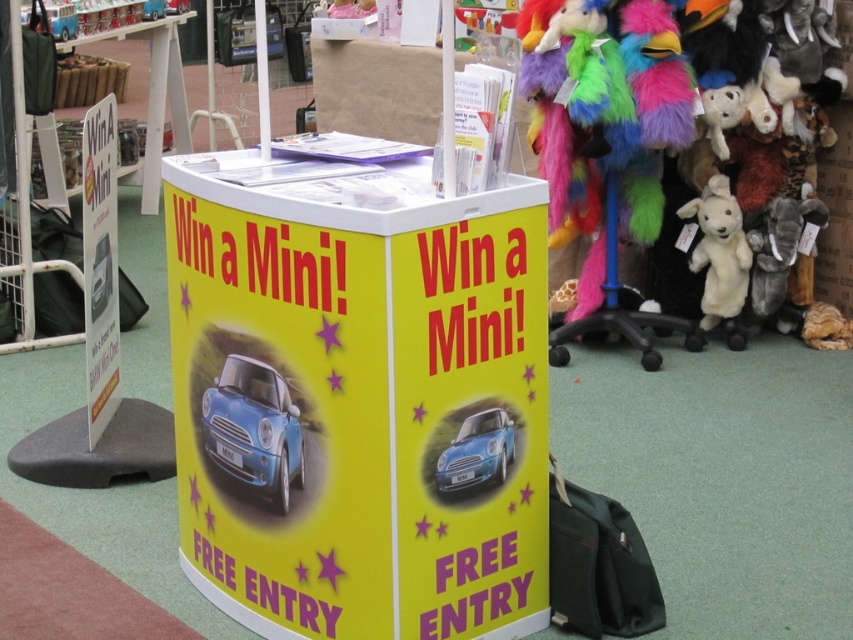
Question: Considering the relative positions of fluffy plush parrot at right and white plush lamb at right in the image provided, where is fluffy plush parrot at right located with respect to white plush lamb at right?

Choices:
 (A) right
 (B) left

Answer: (B)

Question: Does fluffy plush parrot at right lie behind white plush lamb at right?

Choices:
 (A) no
 (B) yes

Answer: (A)

Question: Which object is the closest to the fluffy plush parrot at right?

Choices:
 (A) shiny blue car at center
 (B) blue glossy car at center

Answer: (A)

Question: Which of these objects is positioned closest to the white plush lamb at right?

Choices:
 (A) blue glossy car at center
 (B) shiny blue car at center
 (C) fluffy plush parrot at right

Answer: (C)

Question: Does blue glossy car at center appear over white plush lamb at right?

Choices:
 (A) yes
 (B) no

Answer: (B)

Question: Which of the following is the closest to the observer?

Choices:
 (A) (218, 376)
 (B) (711, 227)
 (C) (460, 444)
 (D) (614, 262)

Answer: (C)